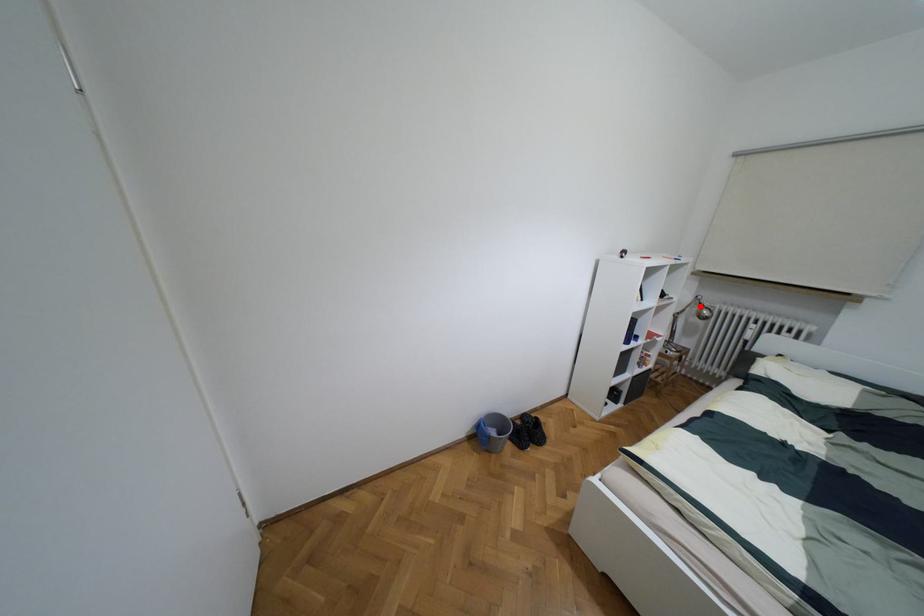
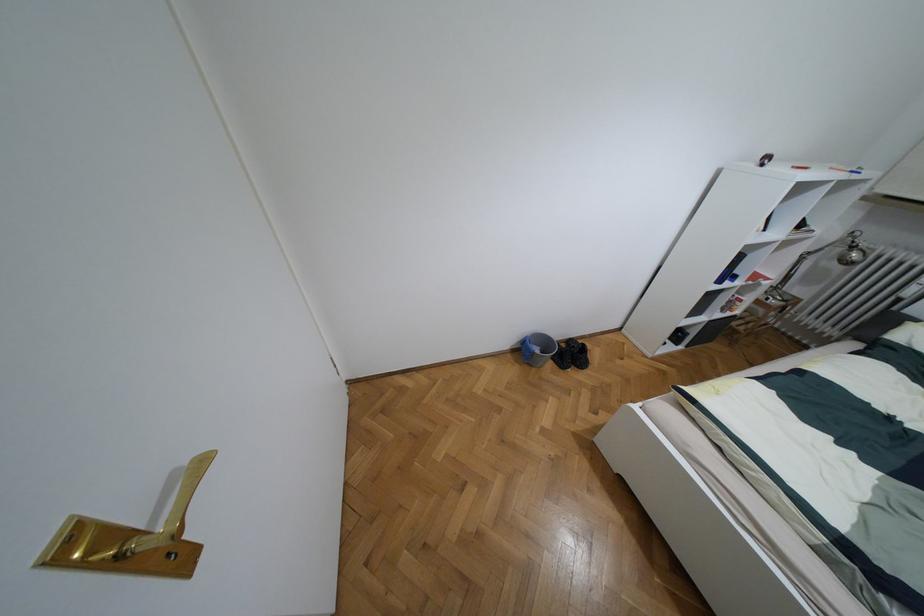
Question: A red point is marked in image1. In image2, is the corresponding 3D point closer to the camera or farther? Reply with the corresponding letter.

Choices:
 (A) The corresponding 3D point is closer.
 (B) The corresponding 3D point is farther.

Answer: (B)